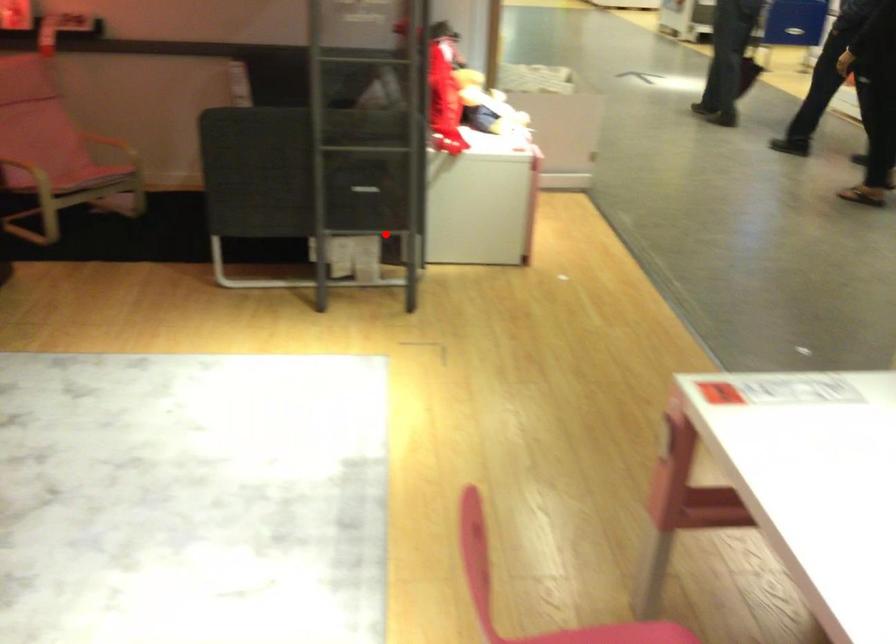
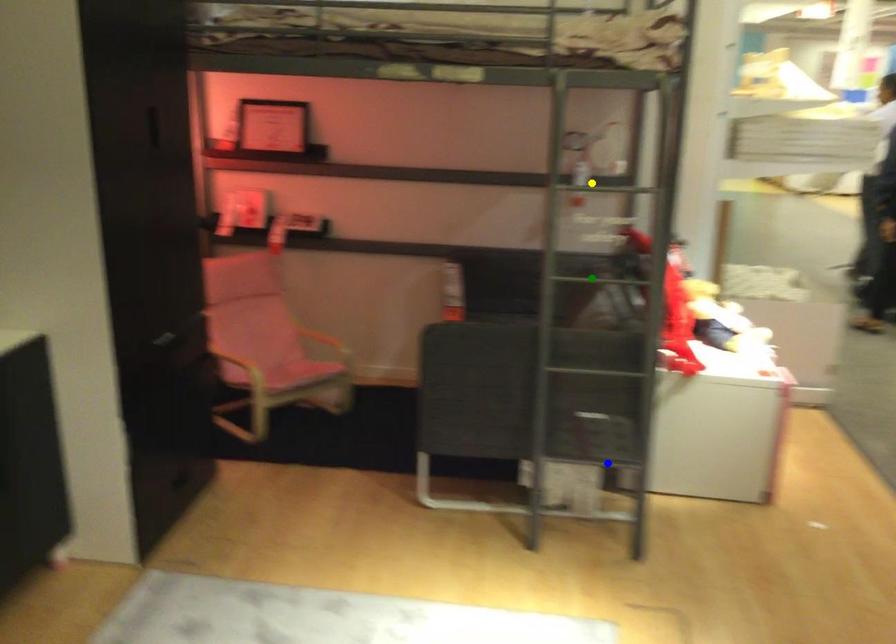
Question: I am providing you with two images of the same scene from different viewpoints. A red point is marked on the first image. You are given multiple points on the second image. Which point in image 2 is actually the same real-world point as the red point in image 1?

Choices:
 (A) blue point
 (B) green point
 (C) yellow point

Answer: (A)